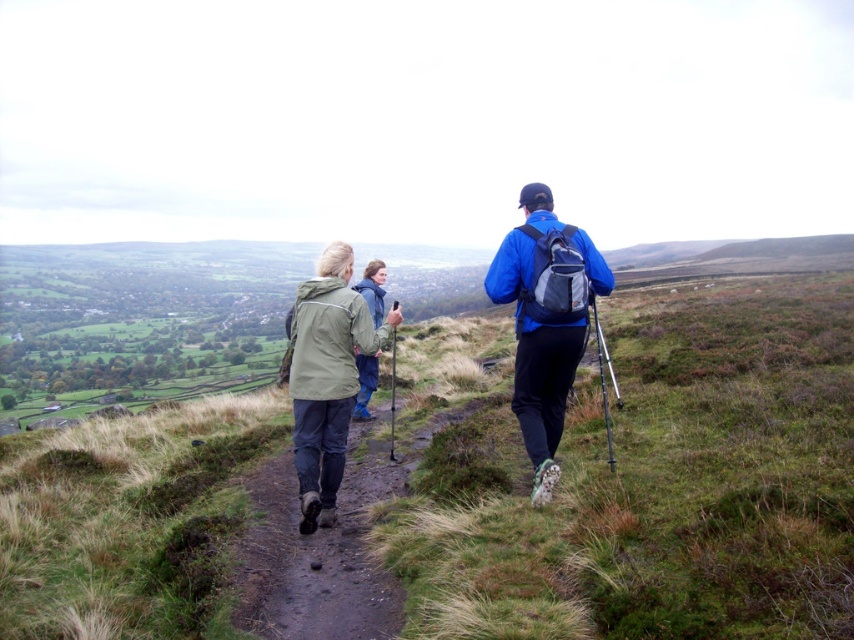
Does green grassy at center have a smaller size compared to green matte jacket at center?

Incorrect, green grassy at center is not smaller in size than green matte jacket at center.

Does green grassy at center come in front of green matte jacket at center?

Yes.

What do you see at coordinates (481, 493) in the screenshot?
I see `green grassy at center` at bounding box center [481, 493].

Image resolution: width=854 pixels, height=640 pixels. In order to click on green grassy at center in this screenshot , I will do `click(481, 493)`.

What do you see at coordinates (545, 321) in the screenshot? The image size is (854, 640). I see `blue matte jacket at center` at bounding box center [545, 321].

Between point (537, 188) and point (306, 460), which one is positioned behind?

Point (537, 188)

The image size is (854, 640). Identify the location of blue matte jacket at center. (545, 321).

Describe the element at coordinates (481, 493) in the screenshot. This screenshot has width=854, height=640. I see `green grassy at center` at that location.

Does green grassy at center have a smaller size compared to blue matte jacket at center?

Incorrect, green grassy at center is not smaller in size than blue matte jacket at center.

You are a GUI agent. You are given a task and a screenshot of the screen. Output one action in this format:
    pyautogui.click(x=<x>, y=<y>)
    Task: Click on the green grassy at center
    This screenshot has width=854, height=640.
    Given the screenshot: What is the action you would take?
    pyautogui.click(x=481, y=493)